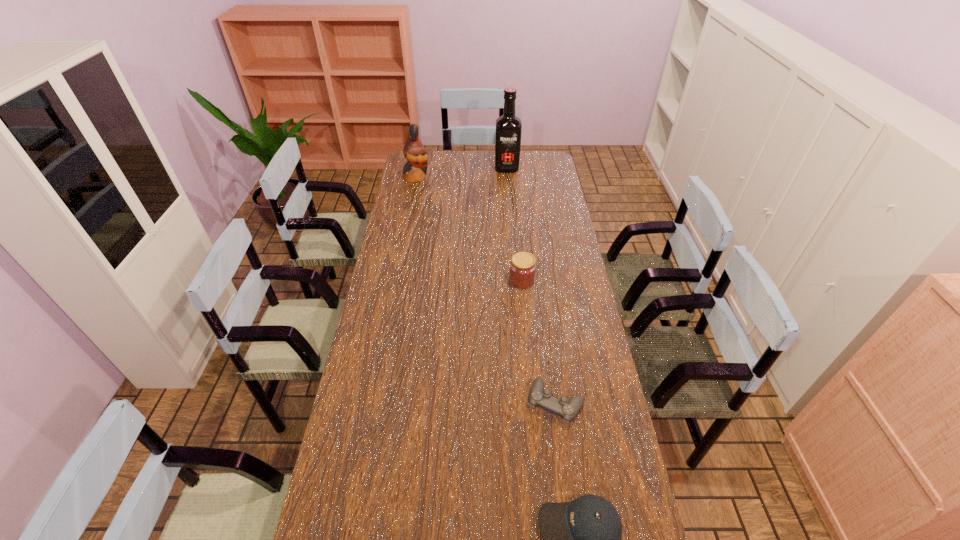
At what (x,y) coordinates should I click in order to perform the action: click on the tallest object. Please return your answer as a coordinate pair (x, y). The width and height of the screenshot is (960, 540). Looking at the image, I should click on click(508, 130).

This screenshot has width=960, height=540. In order to click on parrot in this screenshot , I will do tap(415, 153).

Identify the location of the leftmost object. (415, 153).

Identify the location of jam. (522, 268).

Where is `the third shortest object`? This screenshot has width=960, height=540. the third shortest object is located at coordinates (522, 268).

The width and height of the screenshot is (960, 540). What are the coordinates of `the fourth farthest object` in the screenshot? It's located at (538, 396).

Locate an element on the screen. The image size is (960, 540). the shortest object is located at coordinates (538, 396).

Locate an element on the screen. The height and width of the screenshot is (540, 960). vacant space located on the front-facing side of the liquor is located at coordinates (510, 202).

You are a GUI agent. You are given a task and a screenshot of the screen. Output one action in this format:
    pyautogui.click(x=<x>, y=<y>)
    Task: Click on the free space located 0.150m on the face of the leftmost object
    
    Given the screenshot: What is the action you would take?
    pyautogui.click(x=459, y=177)

Identify the location of vacant space located 0.240m on the front of the jam. The width and height of the screenshot is (960, 540). (527, 340).